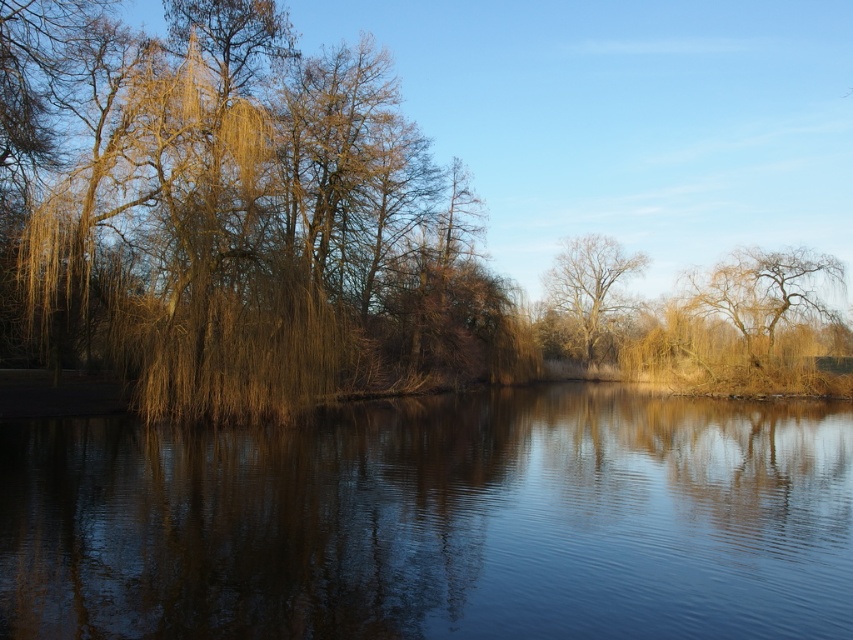
You are standing at the edge of the water and want to take a photo of both the smooth water at center and the brown willow tree at left. Which object will appear larger in the photo?

The smooth water at center will appear larger in the photo because it is closer to the viewer than the brown willow tree at left.

Looking at this image, you are an environmental scientist assessing the width of trees in a natural reserve. You observe the brown willow tree at left and the bare branches tree at center. Based on their positions in the image, which tree is likely wider?

The brown willow tree at left is likely wider than the bare branches tree at center.